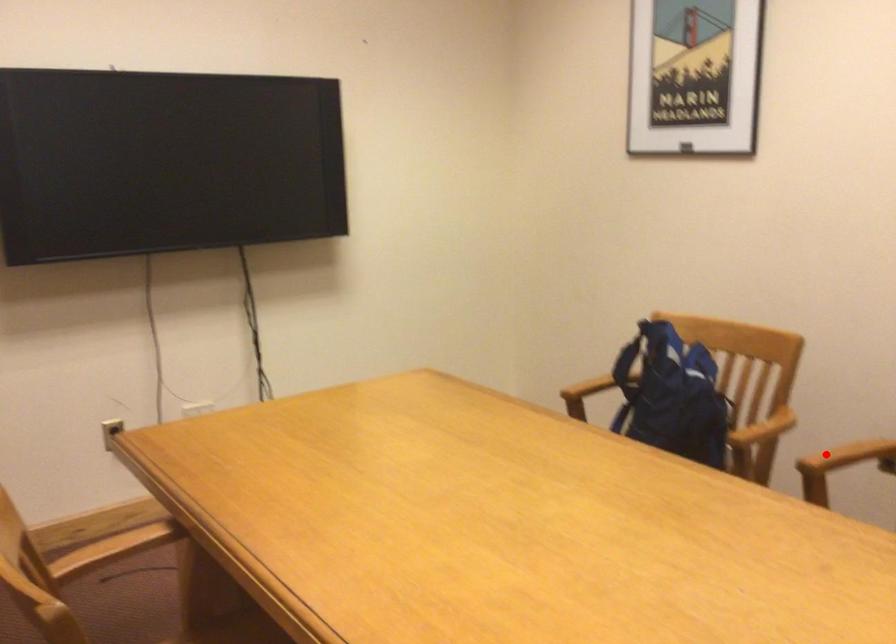
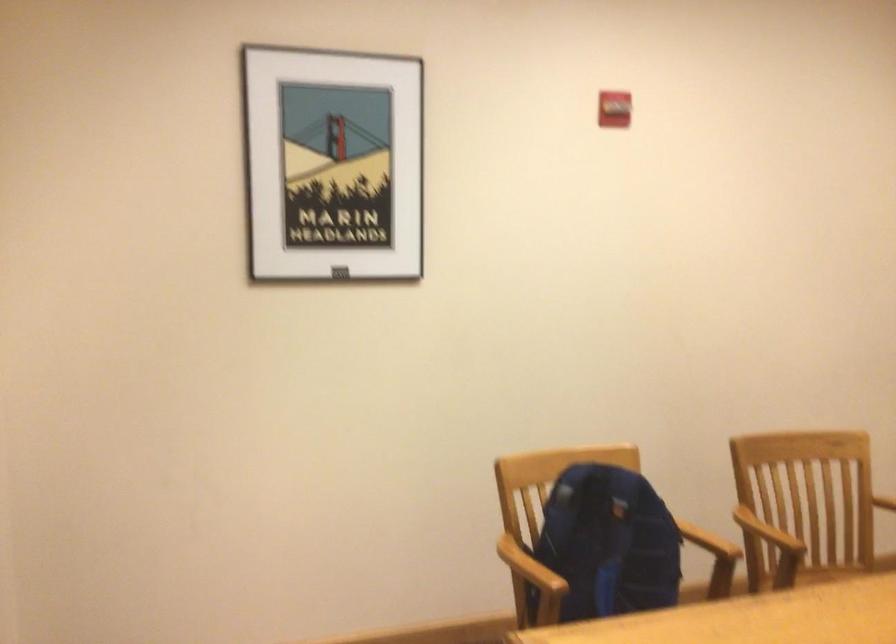
Question: I am providing you with two images of the same scene from different viewpoints. Image1 has a red point marked. In image2, the corresponding 3D location appears at what relative position? Reply with the corresponding letter.

Choices:
 (A) Closer
 (B) Farther

Answer: (B)